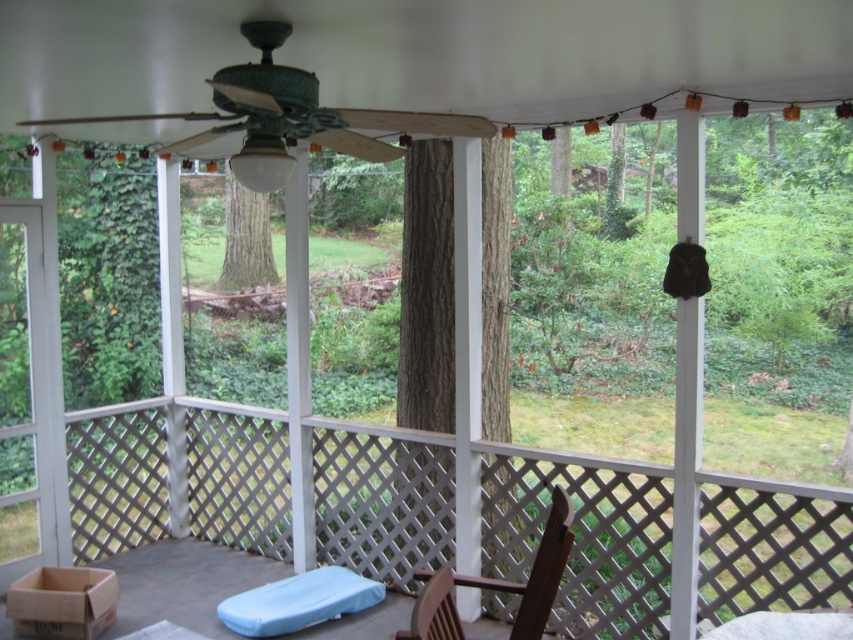
You are standing on the porch and want to sit down. Where is the wooden rocking chair at center located in terms of its position coordinates?

The wooden rocking chair at center is located at the coordinates point [584,536].

You are a delivery person trying to enter the porch through the clear glass door at left. The brown wooden chair at center is blocking your path. Can you walk around the chair to reach the door?

The clear glass door at left is taller than the brown wooden chair at center, so you can walk around the chair to reach the door since the door is higher and won